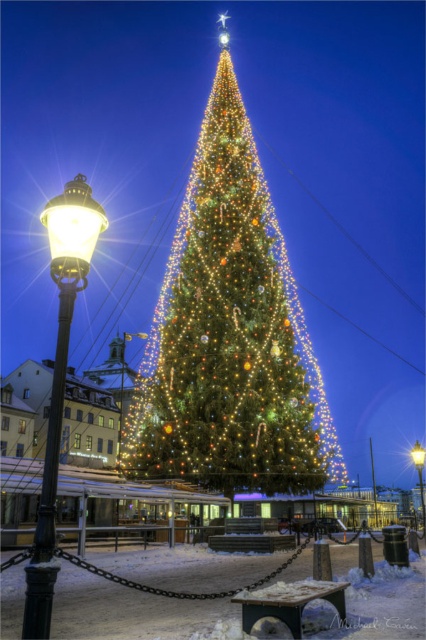
How much distance is there between metallic streetlamp at center and matte black lamp post at lower left?

The distance of metallic streetlamp at center from matte black lamp post at lower left is 69.05 meters.

Can you confirm if metallic streetlamp at center is wider than matte black lamp post at lower left?

Yes, metallic streetlamp at center is wider than matte black lamp post at lower left.

Which is behind, point (416, 464) or point (121, 358)?

Positioned behind is point (121, 358).

I want to click on metallic streetlamp at center, so click(x=420, y=476).

Is green matte christmas tree at center bigger than black polished metal streetlamp at left?

Correct, green matte christmas tree at center is larger in size than black polished metal streetlamp at left.

Is point (175, 256) closer to viewer compared to point (54, 477)?

No.

Between point (227, 310) and point (48, 620), which one is positioned behind?

The point (227, 310) is behind.

Locate an element on the screen. green matte christmas tree at center is located at coordinates (230, 333).

Who is more forward, (48, 509) or (120, 385)?

Point (48, 509) is more forward.

How far apart are black polished metal streetlamp at left and matte black lamp post at lower left?

82.48 meters

The height and width of the screenshot is (640, 426). What are the coordinates of `black polished metal streetlamp at left` in the screenshot? It's located at (49, 480).